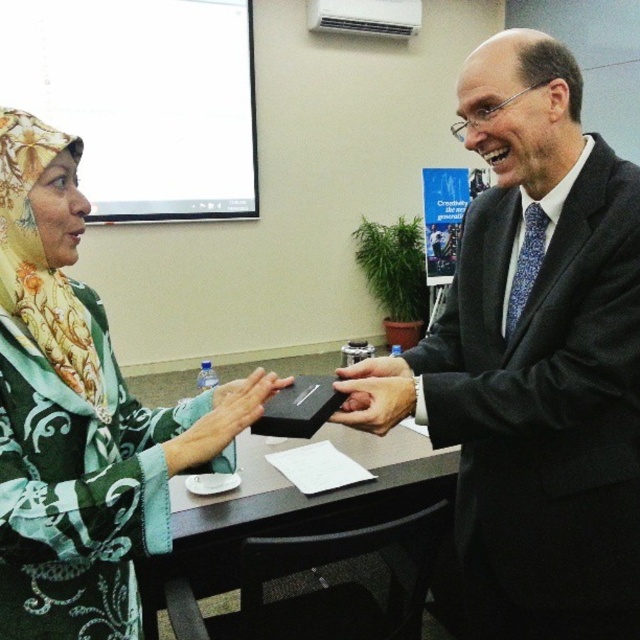
Can you confirm if matte black suit at center is shorter than matte black phone at center?

No, matte black suit at center is not shorter than matte black phone at center.

Is matte black suit at center to the right of matte black phone at center from the viewer's perspective?

Yes, matte black suit at center is to the right of matte black phone at center.

What do you see at coordinates (540, 356) in the screenshot? I see `matte black suit at center` at bounding box center [540, 356].

Find the location of a particular element. The image size is (640, 640). matte black suit at center is located at coordinates (540, 356).

Does green floral scarf at left have a lesser height compared to matte black phone at center?

In fact, green floral scarf at left may be taller than matte black phone at center.

Does green floral scarf at left appear over matte black phone at center?

Indeed, green floral scarf at left is positioned over matte black phone at center.

Is point (116, 628) less distant than point (392, 420)?

Yes.

You are a GUI agent. You are given a task and a screenshot of the screen. Output one action in this format:
    pyautogui.click(x=<x>, y=<y>)
    Task: Click on the green floral scarf at left
    The height and width of the screenshot is (640, 640).
    Given the screenshot: What is the action you would take?
    tap(80, 417)

Who is more distant from viewer, [449,593] or [365,369]?

The point [449,593] is behind.

Does black matte table at center have a larger size compared to matte black phone at center?

Yes, black matte table at center is bigger than matte black phone at center.

Identify the location of black matte table at center. (289, 508).